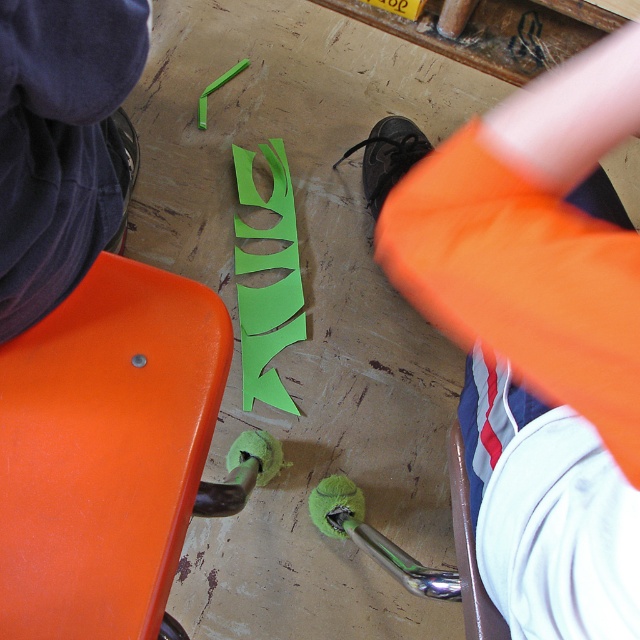
Who is lower down, dark blue fabric at upper left or green paper cutout at center?

green paper cutout at center

Does dark blue fabric at upper left have a greater height compared to green paper cutout at center?

Incorrect, dark blue fabric at upper left's height is not larger of green paper cutout at center's.

Describe the element at coordinates (64, 145) in the screenshot. The height and width of the screenshot is (640, 640). I see `dark blue fabric at upper left` at that location.

Locate an element on the screen. dark blue fabric at upper left is located at coordinates (64, 145).

Who is positioned more to the right, dark blue fabric at upper left or white fabric at lower right?

white fabric at lower right is more to the right.

The image size is (640, 640). I want to click on dark blue fabric at upper left, so click(x=64, y=145).

Identify the location of dark blue fabric at upper left. The width and height of the screenshot is (640, 640). (64, 145).

Does orange fabric pants at lower right have a smaller size compared to orange matte/stained stool at lower left?

No.

Can you confirm if orange fabric pants at lower right is thinner than orange matte/stained stool at lower left?

Yes.

What do you see at coordinates (540, 339) in the screenshot?
I see `orange fabric pants at lower right` at bounding box center [540, 339].

Where is `orange fabric pants at lower right`? Image resolution: width=640 pixels, height=640 pixels. orange fabric pants at lower right is located at coordinates 540,339.